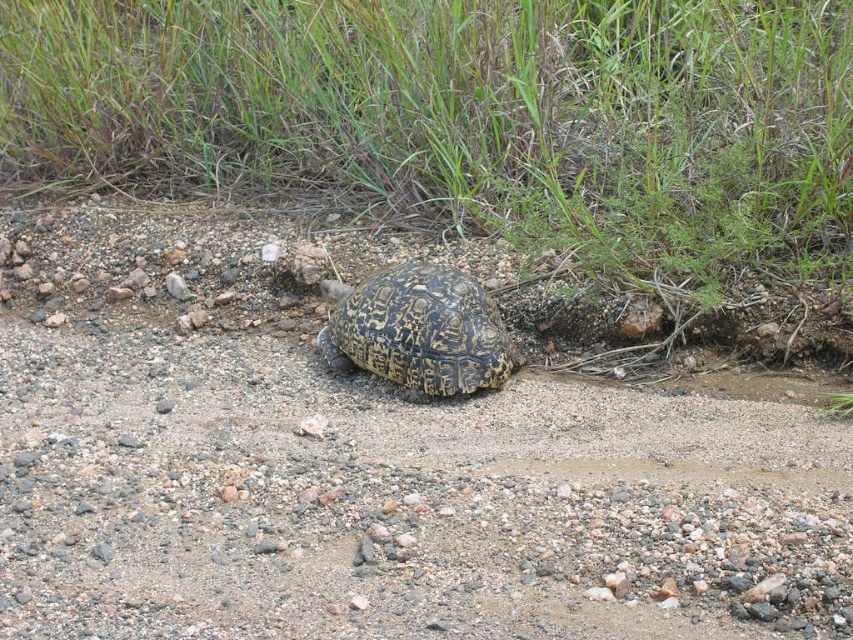
You are a small animal trying to cross from the brown gravel dirt track at center to the green grass at upper center. Which surface will you step on first?

The brown gravel dirt track at center is closer to the viewer than the green grass at upper center, so you will step on the brown gravel dirt track at center first.